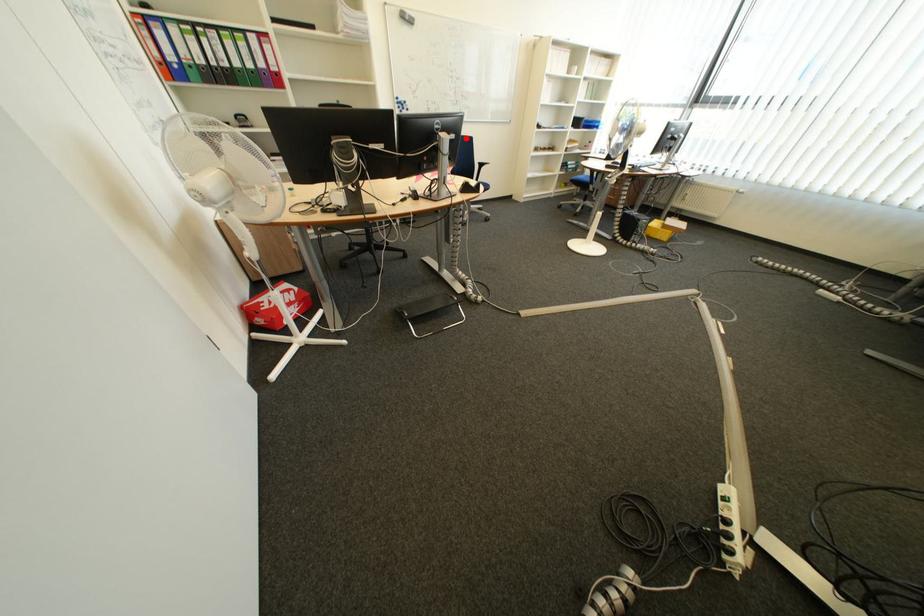
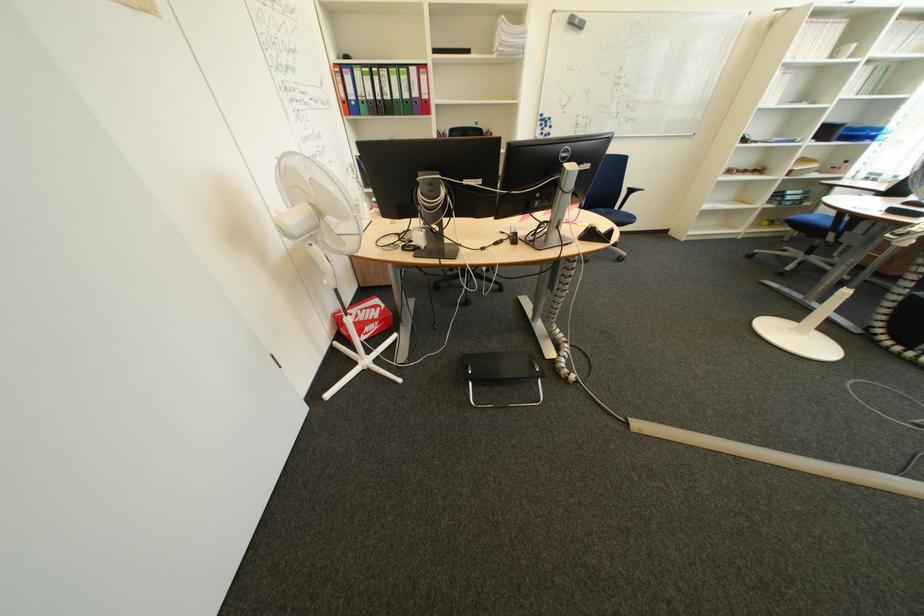
Question: I am providing you with two images of the same scene from different viewpoints. A red point is shown in image1. For the corresponding object point in image2, is it positioned nearer or farther from the camera?

Choices:
 (A) Nearer
 (B) Farther

Answer: (B)